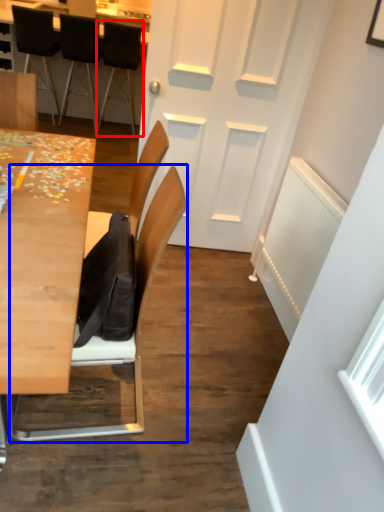
Question: Which object is closer to the camera taking this photo, chair (highlighted by a red box) or chair (highlighted by a blue box)?

Choices:
 (A) chair
 (B) chair

Answer: (B)